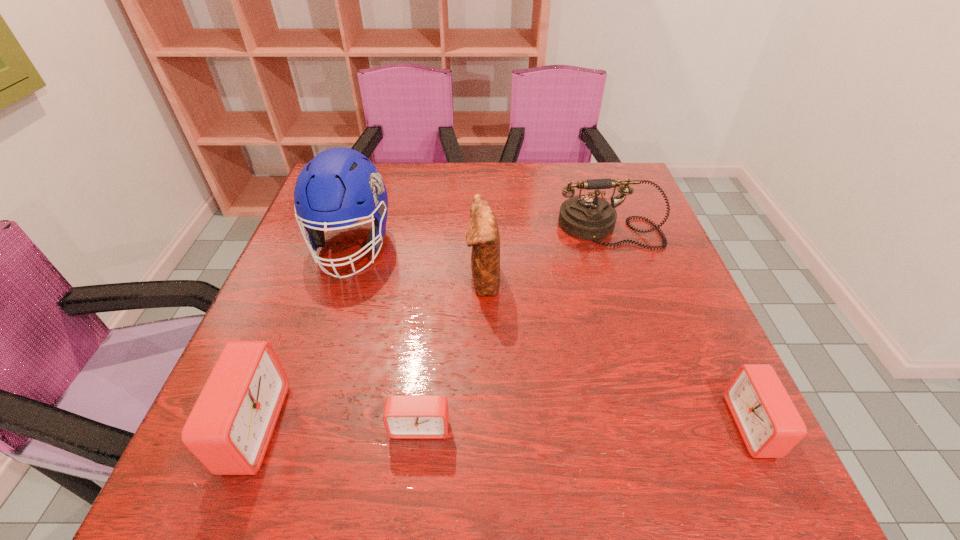
The width and height of the screenshot is (960, 540). Identify the location of blank space located 0.330m on the front-facing side of the rightmost alarm clock. (541, 426).

This screenshot has width=960, height=540. In order to click on blank area located on the front-facing side of the rightmost alarm clock in this screenshot , I will do `click(583, 426)`.

The image size is (960, 540). Find the location of `vacant space situated 0.060m on the front-facing side of the rightmost alarm clock`. vacant space situated 0.060m on the front-facing side of the rightmost alarm clock is located at coordinates (699, 426).

Where is `vacant space located 0.180m on the left of the telephone`? This screenshot has width=960, height=540. vacant space located 0.180m on the left of the telephone is located at coordinates (487, 228).

What are the coordinates of `vacant region located on the open side of the fourth object from left to right` in the screenshot? It's located at (315, 279).

Find the location of a particular element. The height and width of the screenshot is (540, 960). free space located on the open side of the fourth object from left to right is located at coordinates (432, 279).

Identify the location of vacant space located on the open side of the fourth object from left to right. (349, 279).

Locate an element on the screen. This screenshot has height=540, width=960. free space located on the front-facing side of the football helmet is located at coordinates (330, 313).

Where is `object that is at the far edge`? The image size is (960, 540). object that is at the far edge is located at coordinates (587, 217).

Find the location of a particular element. The height and width of the screenshot is (540, 960). alarm clock at the left edge is located at coordinates (230, 426).